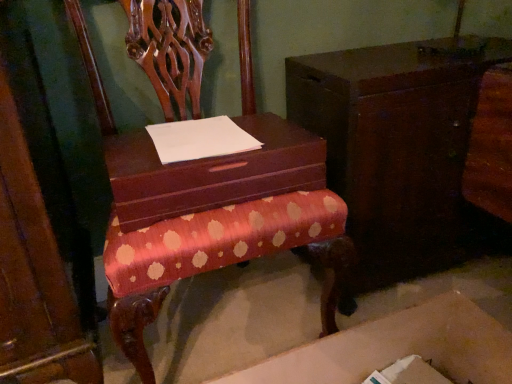
Image resolution: width=512 pixels, height=384 pixels. I want to click on vacant area that lies to the right of white paper at center, so click(270, 133).